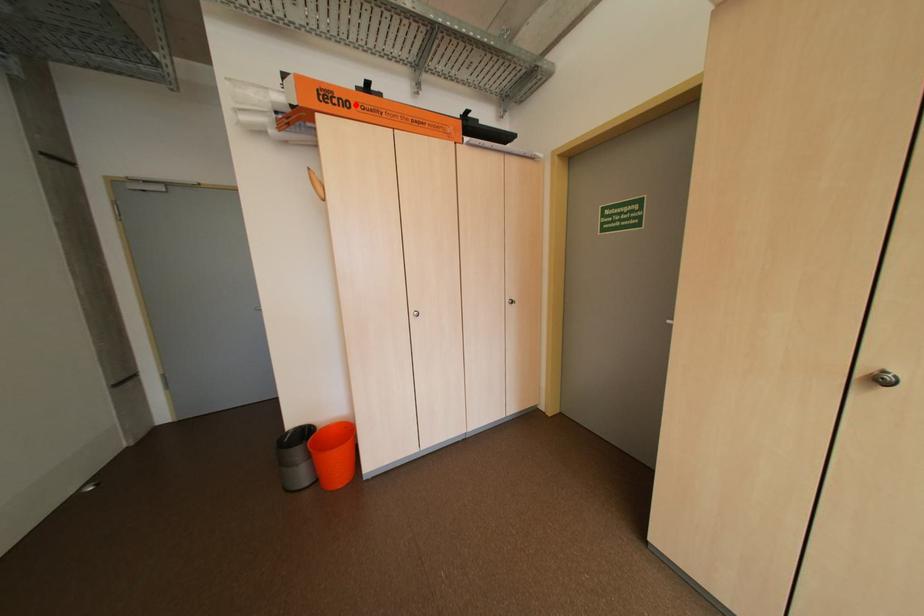
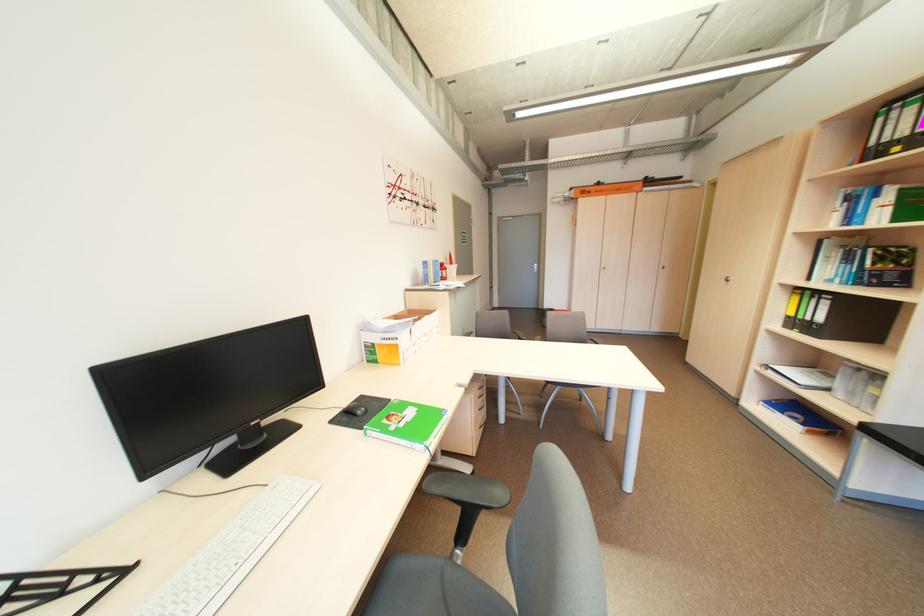
The point at the highlighted location is marked in the first image. Where is the corresponding point in the second image?

(599, 193)